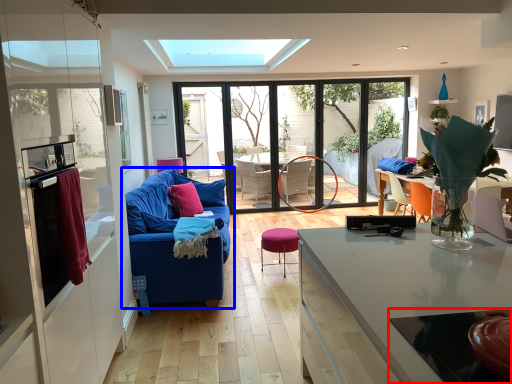
Question: Which object is closer to the camera taking this photo, glass table (highlighted by a red box) or studio couch (highlighted by a blue box)?

Choices:
 (A) glass table
 (B) studio couch

Answer: (A)